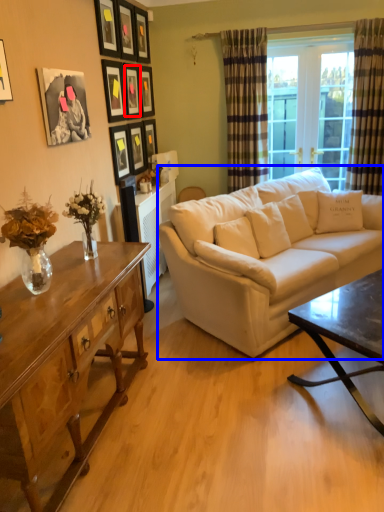
Question: Which object appears closest to the camera in this image, picture frame (highlighted by a red box) or studio couch (highlighted by a blue box)?

Choices:
 (A) picture frame
 (B) studio couch

Answer: (B)